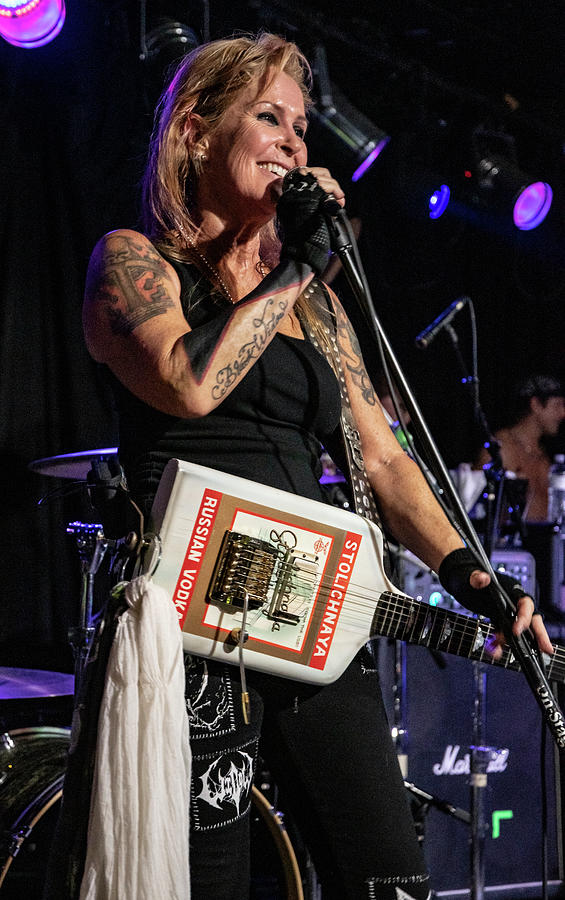
Locate an element on the screen. This screenshot has height=900, width=565. white cloth is located at coordinates (168, 716).